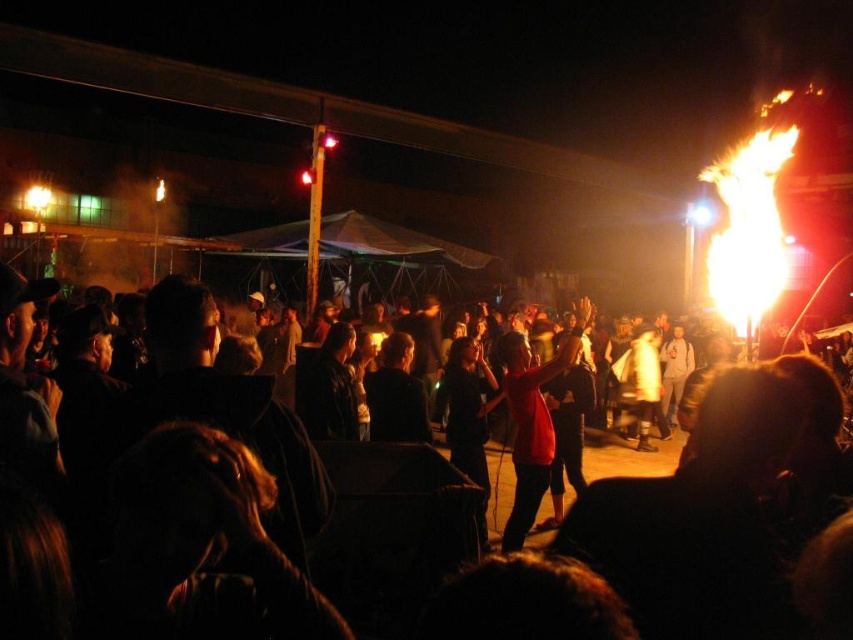
Question: Is matte red shirt at center thinner than red matte shirt at center?

Choices:
 (A) yes
 (B) no

Answer: (B)

Question: Which of the following is the closest to the observer?

Choices:
 (A) red matte shirt at center
 (B) matte red shirt at center

Answer: (B)

Question: Considering the relative positions of matte red shirt at center and red matte shirt at center in the image provided, where is matte red shirt at center located with respect to red matte shirt at center?

Choices:
 (A) right
 (B) left

Answer: (B)

Question: Among these points, which one is nearest to the camera?

Choices:
 (A) (125, 524)
 (B) (508, 376)

Answer: (A)

Question: Does matte red shirt at center appear on the left side of red matte shirt at center?

Choices:
 (A) no
 (B) yes

Answer: (B)

Question: Which object appears farthest from the camera in this image?

Choices:
 (A) matte red shirt at center
 (B) red matte shirt at center

Answer: (B)